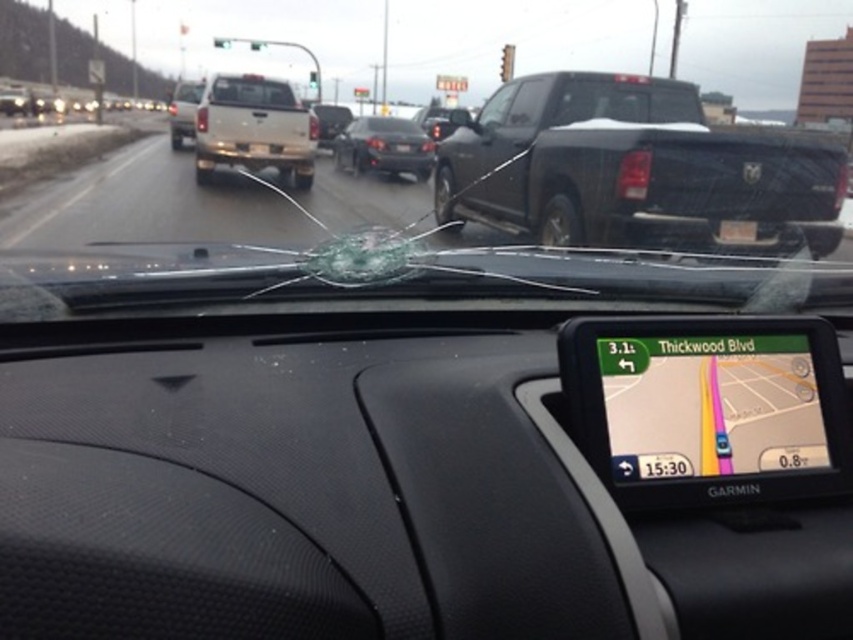
Is point (250, 108) in front of point (178, 132)?

Yes.

Locate an element on the screen. Image resolution: width=853 pixels, height=640 pixels. matte white truck at upper center is located at coordinates (254, 129).

Does black matte truck at upper right have a greater height compared to matte white truck at upper center?

Indeed, black matte truck at upper right has a greater height compared to matte white truck at upper center.

Who is higher up, black matte truck at upper right or matte white truck at upper center?

black matte truck at upper right is higher up.

Is point (619, 160) positioned before point (202, 180)?

That is True.

Where is `black matte truck at upper right`? This screenshot has height=640, width=853. black matte truck at upper right is located at coordinates click(633, 170).

Is satin black sedan at center to the right of silver metallic suv at upper center from the viewer's perspective?

Correct, you'll find satin black sedan at center to the right of silver metallic suv at upper center.

Which is more to the right, satin black sedan at center or silver metallic suv at upper center?

Positioned to the right is satin black sedan at center.

Does point (399, 131) lie behind point (178, 125)?

No, it is in front of (178, 125).

Image resolution: width=853 pixels, height=640 pixels. Identify the location of satin black sedan at center. (383, 147).